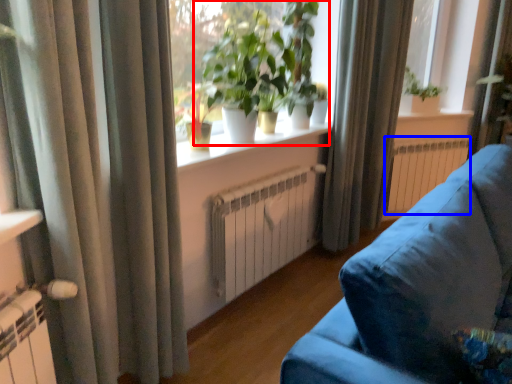
Question: Which point is closer to the camera, houseplant (highlighted by a red box) or radiator (highlighted by a blue box)?

Choices:
 (A) houseplant
 (B) radiator

Answer: (A)